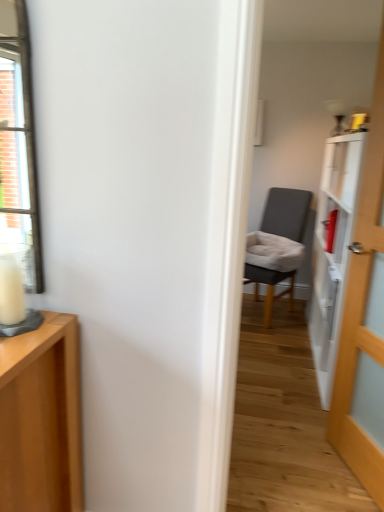
Question: Would you say wooden door at right is inside or outside dark gray fabric chair at center?

Choices:
 (A) inside
 (B) outside

Answer: (B)

Question: Looking at their shapes, would you say wooden door at right is wider or thinner than dark gray fabric chair at center?

Choices:
 (A) wide
 (B) thin

Answer: (B)

Question: Which object is the closest to the white wax candle at left?

Choices:
 (A) wooden door at right
 (B) dark gray fabric chair at center

Answer: (A)

Question: Which object is positioned farthest from the white wax candle at left?

Choices:
 (A) wooden door at right
 (B) dark gray fabric chair at center

Answer: (B)